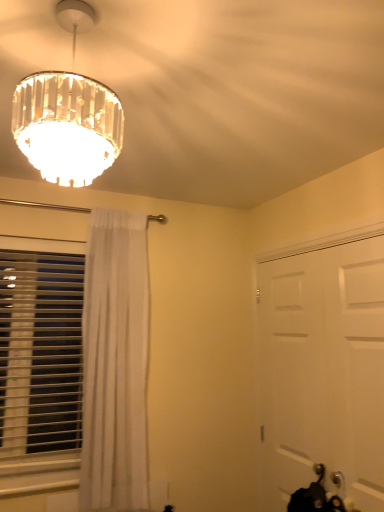
Question: Is white sheer curtain at left outside of white plastic blinds at left?

Choices:
 (A) no
 (B) yes

Answer: (B)

Question: Does white sheer curtain at left have a greater width compared to white plastic blinds at left?

Choices:
 (A) no
 (B) yes

Answer: (B)

Question: From a real-world perspective, is white sheer curtain at left physically above white plastic blinds at left?

Choices:
 (A) yes
 (B) no

Answer: (A)

Question: Is white sheer curtain at left positioned in front of white plastic blinds at left?

Choices:
 (A) yes
 (B) no

Answer: (A)

Question: Is white sheer curtain at left positioned far away from white plastic blinds at left?

Choices:
 (A) yes
 (B) no

Answer: (B)

Question: Can you confirm if white sheer curtain at left is positioned to the right of white plastic blinds at left?

Choices:
 (A) yes
 (B) no

Answer: (A)

Question: Does white matte door at right come behind clear crystal chandelier at upper left?

Choices:
 (A) no
 (B) yes

Answer: (B)

Question: Is white matte door at right thinner than clear crystal chandelier at upper left?

Choices:
 (A) yes
 (B) no

Answer: (A)

Question: Is white matte door at right with clear crystal chandelier at upper left?

Choices:
 (A) yes
 (B) no

Answer: (B)

Question: Can you confirm if white matte door at right is bigger than clear crystal chandelier at upper left?

Choices:
 (A) yes
 (B) no

Answer: (B)

Question: Considering the relative sizes of white matte door at right and clear crystal chandelier at upper left in the image provided, is white matte door at right smaller than clear crystal chandelier at upper left?

Choices:
 (A) yes
 (B) no

Answer: (A)

Question: Can we say white matte door at right lies outside clear crystal chandelier at upper left?

Choices:
 (A) yes
 (B) no

Answer: (A)

Question: Can you confirm if clear crystal chandelier at upper left is shorter than white sheer curtain at left?

Choices:
 (A) no
 (B) yes

Answer: (B)